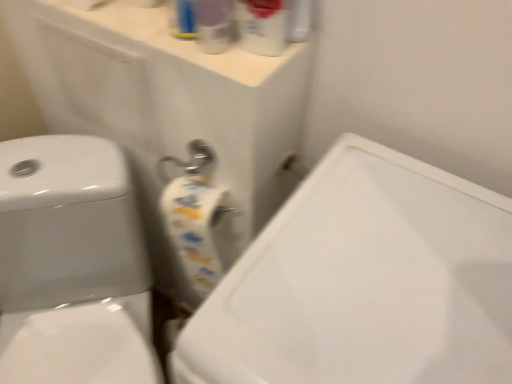
Measure the distance between white glossy toilet at left and camera.

white glossy toilet at left is 29.23 inches from camera.

You are a GUI agent. You are given a task and a screenshot of the screen. Output one action in this format:
    pyautogui.click(x=<x>, y=<y>)
    Task: Click on the white glossy toilet at left
    This screenshot has width=512, height=384.
    Given the screenshot: What is the action you would take?
    pyautogui.click(x=71, y=265)

Is white glossy sink at center thinner than translucent plastic spray bottle at upper center, which is the second cleaning product from left to right?

Incorrect, the width of white glossy sink at center is not less than that of translucent plastic spray bottle at upper center, which is the second cleaning product from left to right.

Is point (455, 382) more distant than point (286, 10)?

No.

Looking at this image, is white glossy sink at center taller or shorter than translucent plastic spray bottle at upper center, the 1th cleaning product in the right-to-left sequence?

Clearly, white glossy sink at center is taller compared to translucent plastic spray bottle at upper center, the 1th cleaning product in the right-to-left sequence.

From the image's perspective, which one is positioned lower, translucent plastic spray bottle at upper center, the second cleaning product when ordered from right to left, or white glossy toilet at left?

white glossy toilet at left.

Is translucent plastic spray bottle at upper center, the second cleaning product when ordered from right to left, looking in the opposite direction of white glossy toilet at left?

No, translucent plastic spray bottle at upper center, the second cleaning product when ordered from right to left,'s orientation is not away from white glossy toilet at left.

How different are the orientations of translucent plastic spray bottle at upper center, the second cleaning product when ordered from right to left, and white glossy toilet at left in degrees?

translucent plastic spray bottle at upper center, the second cleaning product when ordered from right to left, and white glossy toilet at left are facing 42.4 degrees away from each other.

Is translucent plastic spray bottle at upper center, which ranks as the 1th cleaning product in left-to-right order, taller than white glossy toilet at left?

No.

The image size is (512, 384). I want to click on porcelain positioned vertically above the white glossy toilet at left (from a real-world perspective), so click(x=364, y=282).

Is white glossy toilet at left positioned far away from white glossy sink at center?

Actually, white glossy toilet at left and white glossy sink at center are a little close together.

Measure the distance between white glossy toilet at left and white glossy sink at center.

white glossy toilet at left and white glossy sink at center are 49.45 centimeters apart from each other.

Does white glossy toilet at left appear on the left side of white glossy sink at center?

Yes, white glossy toilet at left is to the left of white glossy sink at center.

Locate an element on the screen. The image size is (512, 384). cleaning product above the translucent plastic spray bottle at upper center, the second cleaning product when ordered from right to left (from the image's perspective) is located at coordinates (262, 26).

In the image, is translucent plastic spray bottle at upper center, which ranks as the 1th cleaning product in left-to-right order, on the left side or the right side of translucent plastic spray bottle at upper center, which is the second cleaning product from left to right?

translucent plastic spray bottle at upper center, which ranks as the 1th cleaning product in left-to-right order, is to the left of translucent plastic spray bottle at upper center, which is the second cleaning product from left to right.

Which is farther, (282,9) or (469,274)?

The point (282,9) is more distant.

From the image's perspective, is translucent plastic spray bottle at upper center, the 1th cleaning product in the right-to-left sequence, on top of white glossy sink at center?

Yes, from the image's perspective, translucent plastic spray bottle at upper center, the 1th cleaning product in the right-to-left sequence, is over white glossy sink at center.

Who is smaller, translucent plastic spray bottle at upper center, the 1th cleaning product in the right-to-left sequence, or white glossy sink at center?

With smaller size is translucent plastic spray bottle at upper center, the 1th cleaning product in the right-to-left sequence.

Based on their sizes in the image, would you say white glossy sink at center is bigger or smaller than translucent plastic spray bottle at upper center, which ranks as the 1th cleaning product in left-to-right order?

Clearly, white glossy sink at center is larger in size than translucent plastic spray bottle at upper center, which ranks as the 1th cleaning product in left-to-right order.

Looking at this image, how much distance is there between white glossy sink at center and translucent plastic spray bottle at upper center, which ranks as the 1th cleaning product in left-to-right order?

They are 14.59 inches apart.

What are the coordinates of `porcelain lying below the translucent plastic spray bottle at upper center, the second cleaning product when ordered from right to left (from the image's perspective)` in the screenshot? It's located at click(364, 282).

Which object is positioned more to the left, white glossy sink at center or translucent plastic spray bottle at upper center, the second cleaning product when ordered from right to left?

From the viewer's perspective, translucent plastic spray bottle at upper center, the second cleaning product when ordered from right to left, appears more on the left side.

From a real-world perspective, who is located lower, white glossy toilet at left or translucent plastic spray bottle at upper center, which is the second cleaning product from left to right?

white glossy toilet at left, from a real-world perspective.

Considering the positions of objects white glossy toilet at left and translucent plastic spray bottle at upper center, which is the second cleaning product from left to right, in the image provided, who is in front, white glossy toilet at left or translucent plastic spray bottle at upper center, which is the second cleaning product from left to right,?

translucent plastic spray bottle at upper center, which is the second cleaning product from left to right, is more forward.

How many degrees apart are the facing directions of white glossy toilet at left and translucent plastic spray bottle at upper center, which is the second cleaning product from left to right?

The angle between the facing direction of white glossy toilet at left and the facing direction of translucent plastic spray bottle at upper center, which is the second cleaning product from left to right, is 25.3 degrees.

Would you say white glossy toilet at left is to the left or to the right of translucent plastic spray bottle at upper center, which is the second cleaning product from left to right, in the picture?

In the image, white glossy toilet at left appears on the left side of translucent plastic spray bottle at upper center, which is the second cleaning product from left to right.

Which cleaning product is the 1st one when counting from the left side of the white glossy sink at center? Please provide its 2D coordinates.

[(262, 26)]

In the image, there is a translucent plastic spray bottle at upper center, which ranks as the 1th cleaning product in left-to-right order. Where is `toilet below it (from a real-world perspective)`? The height and width of the screenshot is (384, 512). toilet below it (from a real-world perspective) is located at coordinates (71, 265).

Estimate the real-world distances between objects in this image. Which object is further from white glossy sink at center, translucent plastic spray bottle at upper center, which is the second cleaning product from left to right, or translucent plastic spray bottle at upper center, the second cleaning product when ordered from right to left?

Based on the image, translucent plastic spray bottle at upper center, the second cleaning product when ordered from right to left, appears to be further to white glossy sink at center.

Looking at this image, from the image, which object appears to be nearer to white glossy toilet at left, white glossy sink at center or translucent plastic spray bottle at upper center, which ranks as the 1th cleaning product in left-to-right order?

white glossy sink at center lies closer to white glossy toilet at left than the other object.

Considering their positions, is white glossy sink at center positioned closer to white glossy toilet at left than translucent plastic spray bottle at upper center, the 1th cleaning product in the right-to-left sequence?

white glossy sink at center lies closer to white glossy toilet at left than the other object.

Looking at the image, which one is located further to translucent plastic spray bottle at upper center, the second cleaning product when ordered from right to left, white glossy toilet at left or translucent plastic spray bottle at upper center, which is the second cleaning product from left to right?

Based on the image, white glossy toilet at left appears to be further to translucent plastic spray bottle at upper center, the second cleaning product when ordered from right to left.

Considering their positions, is white glossy toilet at left positioned closer to translucent plastic spray bottle at upper center, the 1th cleaning product in the right-to-left sequence, than white glossy sink at center?

white glossy sink at center is positioned closer to the anchor translucent plastic spray bottle at upper center, the 1th cleaning product in the right-to-left sequence.

Which object lies further to the anchor point translucent plastic spray bottle at upper center, which is the second cleaning product from left to right, white glossy sink at center or translucent plastic spray bottle at upper center, which ranks as the 1th cleaning product in left-to-right order?

white glossy sink at center is positioned further to the anchor translucent plastic spray bottle at upper center, which is the second cleaning product from left to right.

From the image, which object appears to be farther from translucent plastic spray bottle at upper center, which ranks as the 1th cleaning product in left-to-right order, white glossy sink at center or translucent plastic spray bottle at upper center, the 1th cleaning product in the right-to-left sequence?

white glossy sink at center lies further to translucent plastic spray bottle at upper center, which ranks as the 1th cleaning product in left-to-right order, than the other object.

Considering their positions, is white glossy sink at center positioned closer to translucent plastic spray bottle at upper center, the 1th cleaning product in the right-to-left sequence, than white glossy toilet at left?

The object closer to translucent plastic spray bottle at upper center, the 1th cleaning product in the right-to-left sequence, is white glossy sink at center.

At what (x,y) coordinates should I click in order to perform the action: click on toilet that lies between translucent plastic spray bottle at upper center, the second cleaning product when ordered from right to left, and white glossy sink at center from top to bottom. Please return your answer as a coordinate pair (x, y). The width and height of the screenshot is (512, 384). Looking at the image, I should click on (71, 265).

What are the coordinates of `toilet between translucent plastic spray bottle at upper center, the 1th cleaning product in the right-to-left sequence, and white glossy sink at center, in the vertical direction` in the screenshot? It's located at (71, 265).

Where is `cleaning product between translucent plastic spray bottle at upper center, the 1th cleaning product in the right-to-left sequence, and white glossy toilet at left, in the vertical direction`? cleaning product between translucent plastic spray bottle at upper center, the 1th cleaning product in the right-to-left sequence, and white glossy toilet at left, in the vertical direction is located at coordinates (213, 25).

You are a GUI agent. You are given a task and a screenshot of the screen. Output one action in this format:
    pyautogui.click(x=<x>, y=<y>)
    Task: Click on the cleaning product between translucent plastic spray bottle at upper center, the 1th cleaning product in the right-to-left sequence, and white glossy sink at center vertically
    
    Given the screenshot: What is the action you would take?
    pyautogui.click(x=213, y=25)